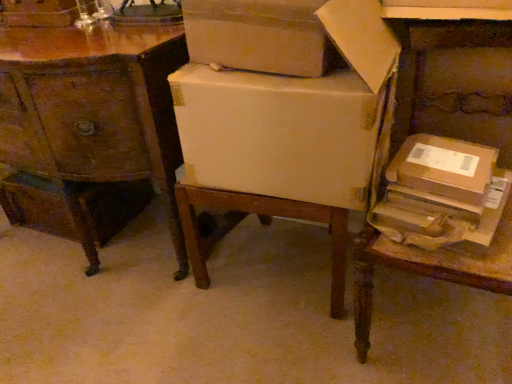
You are a GUI agent. You are given a task and a screenshot of the screen. Output one action in this format:
    pyautogui.click(x=<x>, y=<y>)
    Task: Click on the free point above brown cardboard box at right, marked as the second cardboard box in a left-to-right arrangement (from a real-world perspective)
    This screenshot has height=384, width=512.
    Given the screenshot: What is the action you would take?
    pyautogui.click(x=438, y=159)